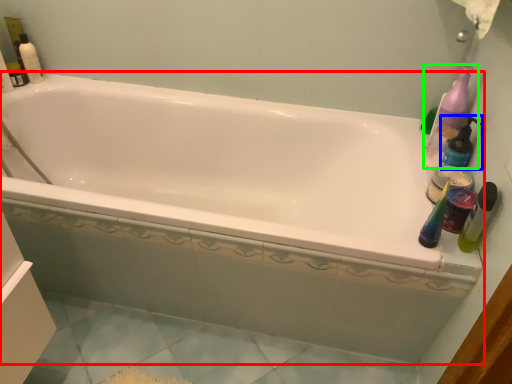
Question: Which object is the closest to the bathtub (highlighted by a red box)? Choose among these: cleaning product (highlighted by a blue box) or cleaning product (highlighted by a green box).

Choices:
 (A) cleaning product
 (B) cleaning product

Answer: (B)